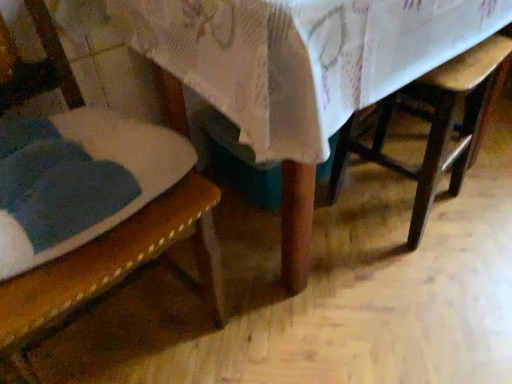
At what (x,y) coordinates should I click in order to perform the action: click on vacant space in wooden textured chair at left (from a real-world perspective). Please return your answer as a coordinate pair (x, y). This screenshot has width=512, height=384. Looking at the image, I should click on (125, 326).